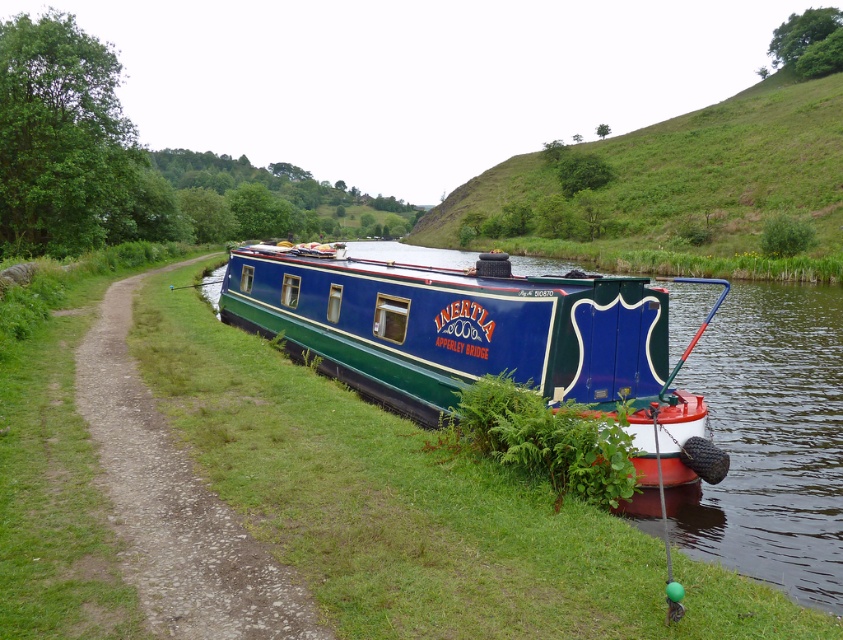
Who is positioned more to the right, green grass at lower center or blue glossy barge at center?

blue glossy barge at center is more to the right.

Is green grass at lower center positioned before blue glossy barge at center?

Yes, it is in front of blue glossy barge at center.

You are a GUI agent. You are given a task and a screenshot of the screen. Output one action in this format:
    pyautogui.click(x=<x>, y=<y>)
    Task: Click on the green grass at lower center
    
    Given the screenshot: What is the action you would take?
    pyautogui.click(x=416, y=508)

Can you confirm if blue glossy barge at center is positioned above blue/green painted narrowboat at right?

Yes.

Between blue glossy barge at center and blue/green painted narrowboat at right, which one appears on the right side from the viewer's perspective?

From the viewer's perspective, blue glossy barge at center appears more on the right side.

Does point (454, 276) come behind point (285, 572)?

Yes, point (454, 276) is farther from viewer.

Identify the location of blue glossy barge at center. The height and width of the screenshot is (640, 843). (474, 339).

Measure the distance between green grassy hillside at upper center and camera.

They are 128.02 feet apart.

This screenshot has height=640, width=843. In order to click on green grassy hillside at upper center in this screenshot , I will do `click(680, 189)`.

Between point (713, 227) and point (140, 438), which one is positioned in front?

Point (140, 438)

Where is `green grassy hillside at upper center`? This screenshot has width=843, height=640. green grassy hillside at upper center is located at coordinates (680, 189).